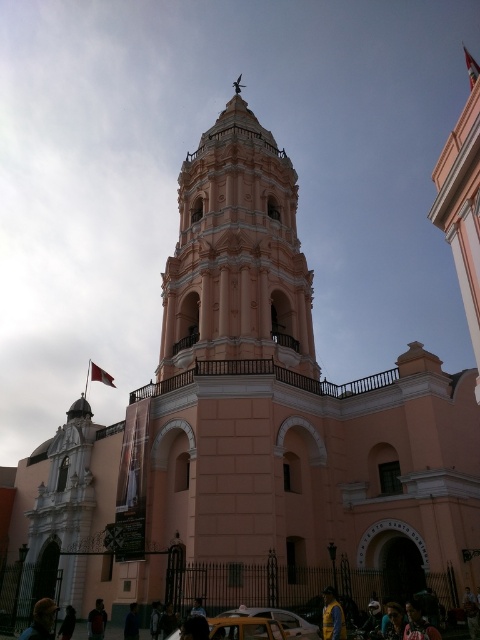
You are a photographer standing in front of the historic building. You notice two elements in your viewfinder, the golden hair at lower left and the dark blue shirt at lower center. Which of these elements appears larger in the photo?

The golden hair at lower left appears larger in the photo because it is much taller than the dark blue shirt at lower center.

You are a photographer trying to capture a clear shot of the historic building. You notice two people in the foreground who might obstruct your view. The golden hair at lower left and the dark blue shirt at lower center are both in your frame. Which of these two objects is larger in your current camera view?

The golden hair at lower left is bigger than the dark blue shirt at lower center, so it is larger in the camera view.